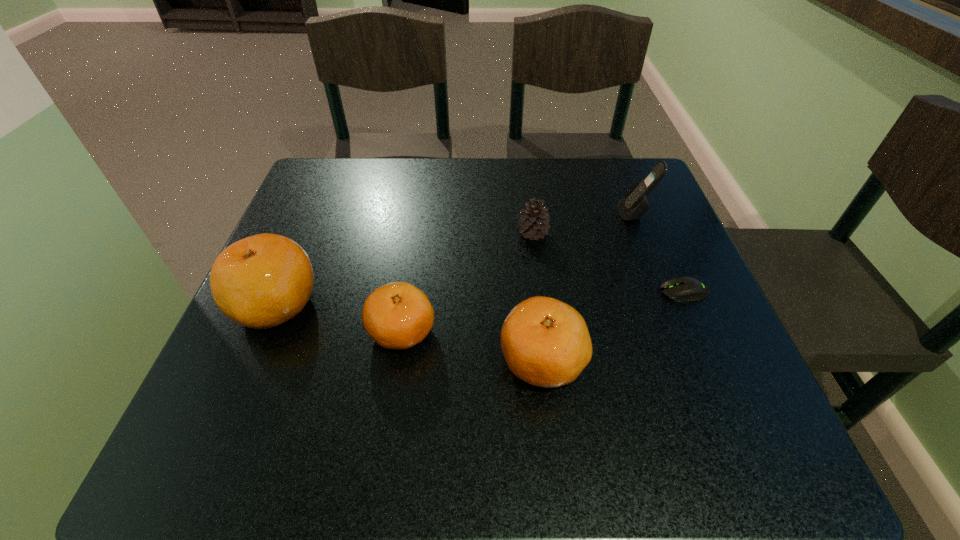
The height and width of the screenshot is (540, 960). I want to click on vacant space situated 0.150m on the back of the second tallest clementine, so click(x=532, y=270).

Image resolution: width=960 pixels, height=540 pixels. Find the location of `free space located on the wheel side of the shortest object`. free space located on the wheel side of the shortest object is located at coordinates (593, 292).

At what (x,y) coordinates should I click in order to perform the action: click on vacant area located on the wheel side of the shortest object. Please return your answer as a coordinate pair (x, y). Looking at the image, I should click on (507, 292).

This screenshot has width=960, height=540. I want to click on free point located on the wheel side of the shortest object, so click(558, 292).

You are a GUI agent. You are given a task and a screenshot of the screen. Output one action in this format:
    pyautogui.click(x=<x>, y=<y>)
    Task: Click on the vacant point located 0.390m on the front-facing side of the cellular telephone
    The image size is (960, 540).
    Given the screenshot: What is the action you would take?
    pyautogui.click(x=454, y=214)

This screenshot has width=960, height=540. In order to click on vacant space situated 0.240m on the front-facing side of the cellular telephone in this screenshot , I will do `click(517, 214)`.

You are a GUI agent. You are given a task and a screenshot of the screen. Output one action in this format:
    pyautogui.click(x=<x>, y=<y>)
    Task: Click on the free region located on the front-facing side of the cellular telephone
    
    Given the screenshot: What is the action you would take?
    pyautogui.click(x=539, y=214)

Locate an element on the screen. free space located on the left of the pinecone is located at coordinates (420, 233).

Image resolution: width=960 pixels, height=540 pixels. I want to click on object that is positioned at the far edge, so click(x=634, y=204).

Identify the location of object situated at the near edge. The image size is (960, 540). (545, 342).